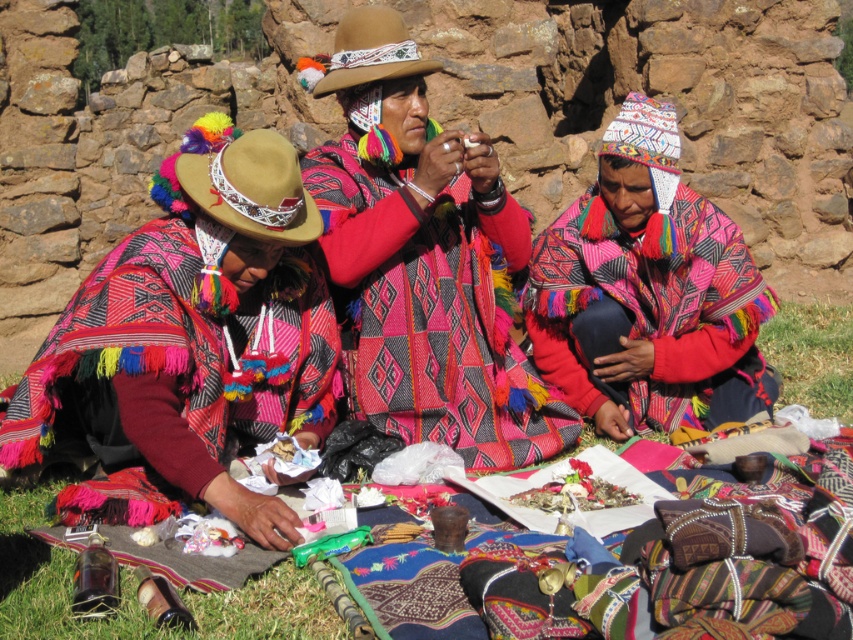
Is point (363, 312) farther from camera compared to point (770, 324)?

No, (363, 312) is closer to viewer.

Is textured wool poncho at center shorter than green grass at lower right?

Yes, textured wool poncho at center is shorter than green grass at lower right.

In the scene shown: Who is more forward, (410,385) or (851,380)?

Positioned in front is point (410,385).

At what (x,y) coordinates should I click in order to perform the action: click on textured wool poncho at center. Please return your answer as a coordinate pair (x, y). The height and width of the screenshot is (640, 853). Looking at the image, I should click on (434, 308).

Does matte pink shawl at left have a larger size compared to beaded tan cowboy hat at center?

Indeed, matte pink shawl at left has a larger size compared to beaded tan cowboy hat at center.

Does matte pink shawl at left have a smaller size compared to beaded tan cowboy hat at center?

No.

Where is `matte pink shawl at left`? Image resolution: width=853 pixels, height=640 pixels. matte pink shawl at left is located at coordinates (196, 330).

Is textured wool poncho at center taller than knitted wool sweater at center?

Incorrect, textured wool poncho at center's height is not larger of knitted wool sweater at center's.

Between point (456, 291) and point (729, 296), which one is positioned behind?

The point (729, 296) is more distant.

Which is in front, point (370, 218) or point (564, 308)?

Point (370, 218) is more forward.

This screenshot has height=640, width=853. Find the location of `textured wool poncho at center`. textured wool poncho at center is located at coordinates (434, 308).